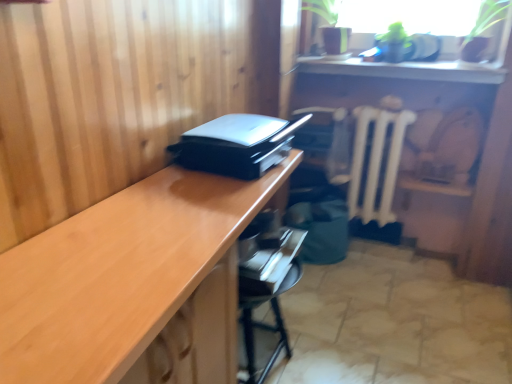
Question: Can you confirm if black plastic printer at center is bigger than white matte radiator at center?

Choices:
 (A) yes
 (B) no

Answer: (B)

Question: Does black plastic printer at center have a lesser height compared to white matte radiator at center?

Choices:
 (A) no
 (B) yes

Answer: (B)

Question: Is white matte radiator at center inside black plastic printer at center?

Choices:
 (A) no
 (B) yes

Answer: (A)

Question: Is black plastic printer at center facing towards white matte radiator at center?

Choices:
 (A) yes
 (B) no

Answer: (B)

Question: Does black plastic printer at center appear on the right side of white matte radiator at center?

Choices:
 (A) yes
 (B) no

Answer: (B)

Question: In terms of height, does black plastic drawer at center look taller or shorter compared to white matte radiator at center?

Choices:
 (A) short
 (B) tall

Answer: (A)

Question: Does point pyautogui.click(x=330, y=140) appear closer or farther from the camera than point pyautogui.click(x=357, y=177)?

Choices:
 (A) closer
 (B) farther

Answer: (A)

Question: Is black plastic drawer at center in front of or behind white matte radiator at center in the image?

Choices:
 (A) front
 (B) behind

Answer: (B)

Question: Looking at their shapes, would you say black plastic drawer at center is wider or thinner than white matte radiator at center?

Choices:
 (A) wide
 (B) thin

Answer: (A)

Question: Considering the positions of point (234, 172) and point (296, 130), is point (234, 172) closer or farther from the camera than point (296, 130)?

Choices:
 (A) closer
 (B) farther

Answer: (A)

Question: Relative to black plastic drawer at center, is black plastic printer at center in front or behind?

Choices:
 (A) front
 (B) behind

Answer: (A)

Question: Would you say black plastic printer at center is to the left or to the right of black plastic drawer at center in the picture?

Choices:
 (A) right
 (B) left

Answer: (B)

Question: In terms of width, does black plastic printer at center look wider or thinner when compared to black plastic drawer at center?

Choices:
 (A) thin
 (B) wide

Answer: (B)

Question: Relative to metallic black drawer at lower center, is white matte radiator at center in front or behind?

Choices:
 (A) front
 (B) behind

Answer: (B)

Question: In terms of width, does white matte radiator at center look wider or thinner when compared to metallic black drawer at lower center?

Choices:
 (A) wide
 (B) thin

Answer: (B)